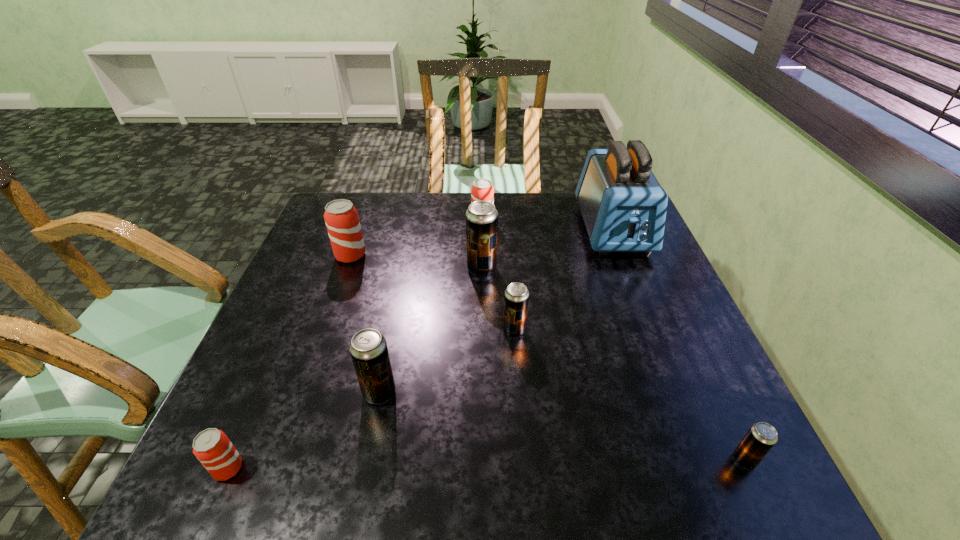
Locate an element on the screen. The height and width of the screenshot is (540, 960). orange beer can object that ranks as the closest to the rightmost black beer can is located at coordinates (482, 189).

Select which orange beer can is the third closest to the toaster. Please provide its 2D coordinates. Your answer should be formatted as a tuple, i.e. [(x, y)], where the tuple contains the x and y coordinates of a point satisfying the conditions above.

[(212, 447)]

Image resolution: width=960 pixels, height=540 pixels. I want to click on blank space that satisfies the following two spatial constraints: 1. on the front side of the second orange beer can from right to left; 2. on the left side of the sixth farthest object, so click(301, 393).

At what (x,y) coordinates should I click in order to perform the action: click on blank space that satisfies the following two spatial constraints: 1. on the back side of the farthest beer can; 2. on the right side of the nearest orange beer can. Please return your answer as a coordinate pair (x, y). Looking at the image, I should click on (336, 220).

Where is `free region that satisfies the following two spatial constraints: 1. on the front side of the smallest black beer can; 2. on the left side of the leftmost black beer can`? The image size is (960, 540). free region that satisfies the following two spatial constraints: 1. on the front side of the smallest black beer can; 2. on the left side of the leftmost black beer can is located at coordinates (366, 460).

The image size is (960, 540). I want to click on blank area in the image that satisfies the following two spatial constraints: 1. on the front side of the rightmost beer can; 2. on the right side of the farthest black beer can, so click(483, 460).